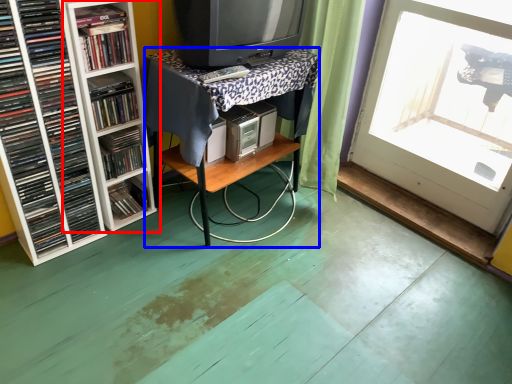
Question: Which of the following is the farthest to the observer, shelf (highlighted by a red box) or table (highlighted by a blue box)?

Choices:
 (A) shelf
 (B) table

Answer: (B)